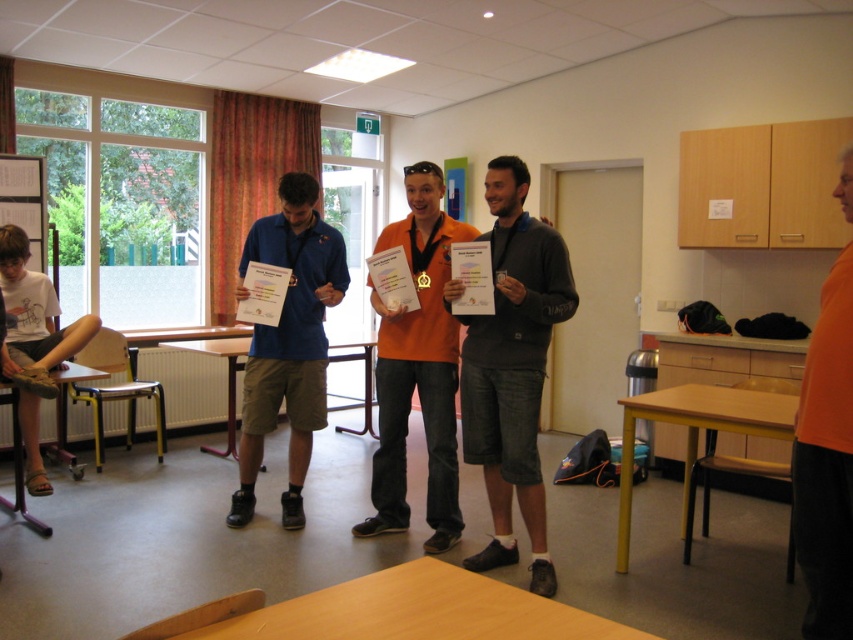
You are standing in the classroom and want to hand out certificates to three people. The first person is wearing an orange matte shirt at center. Where should you look to find them?

The orange matte shirt at center is located at point (827, 461), so you should look towards that coordinate to find them.

You are organizing a photo shoot and want to ensure that all participants are visible in the group photo. Given that the blue fabric shirt at center and orange matte shirt at center are in the same row, which one should be placed closer to the camera to maintain visibility?

The orange matte shirt at center should be placed closer to the camera since it is smaller in size compared to the blue fabric shirt at center, ensuring both are equally visible.

You are organizing a school event and need to place a decorative banner between the dark gray cotton shorts at center and the metallic silver bulletin board at upper left. Which object should the banner be placed closer to if you want it to be at the same height as the taller object?

The banner should be placed closer to the dark gray cotton shorts at center because it is taller than the metallic silver bulletin board at upper left.